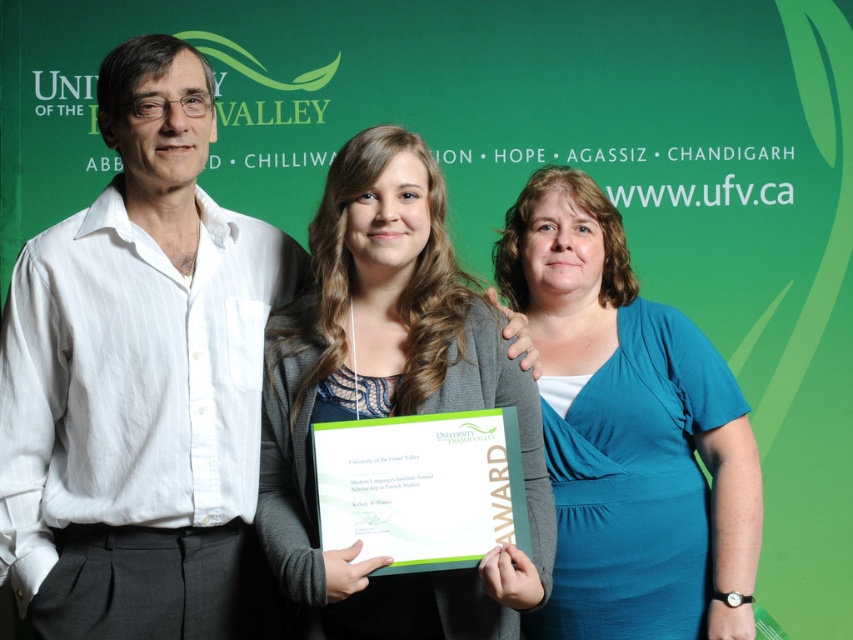
Question: Does blue jersey at center have a lesser width compared to green paper award at center?

Choices:
 (A) yes
 (B) no

Answer: (B)

Question: Does white cotton shirt at left have a greater width compared to green paper award at center?

Choices:
 (A) no
 (B) yes

Answer: (B)

Question: Which object is farther from the camera taking this photo?

Choices:
 (A) matte gray cardigan at center
 (B) blue jersey at center

Answer: (B)

Question: From the image, what is the correct spatial relationship of white cotton shirt at left in relation to green paper award at center?

Choices:
 (A) below
 (B) above

Answer: (B)

Question: Which of the following is the farthest from the observer?

Choices:
 (A) blue jersey at center
 (B) white cotton shirt at left

Answer: (A)

Question: Which object appears closest to the camera in this image?

Choices:
 (A) green paper award at center
 (B) white cotton shirt at left
 (C) matte gray cardigan at center
 (D) blue jersey at center

Answer: (C)